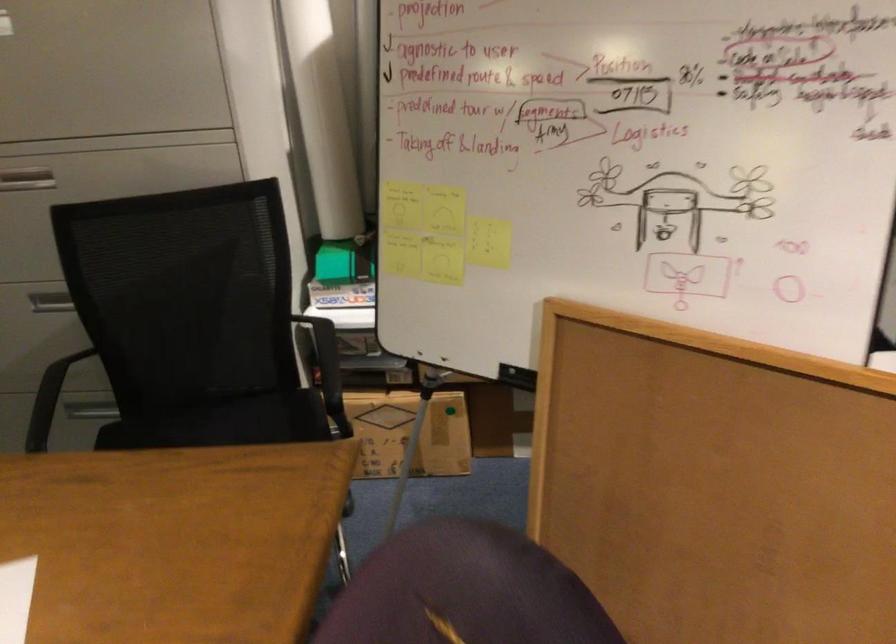
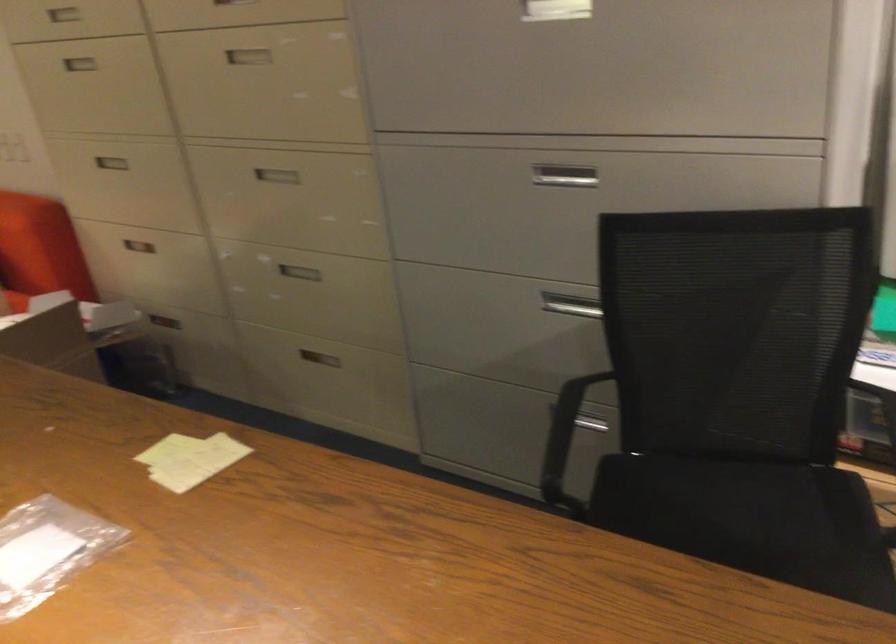
Locate, in the second image, the point that corresponds to point 116,401 in the first image.

(599, 410)